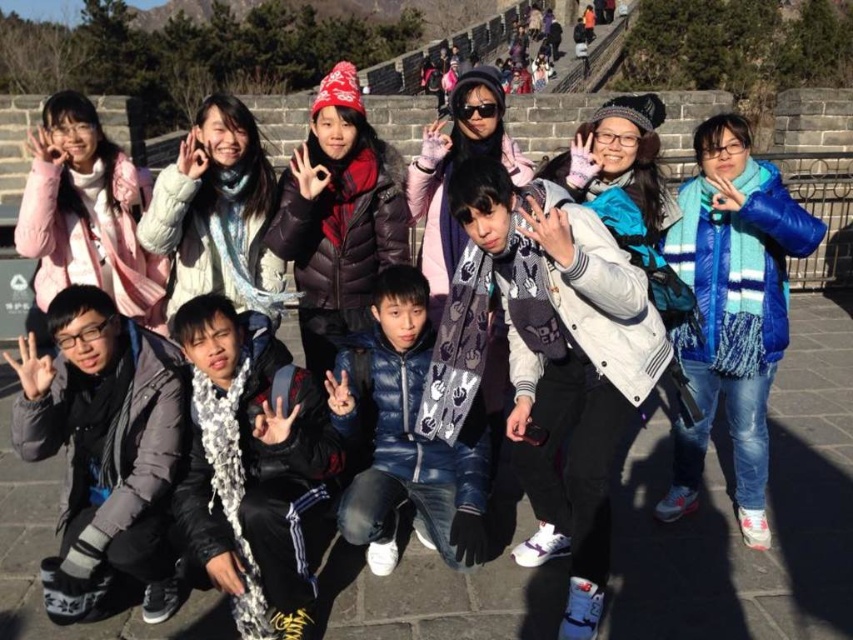
You are a photographer standing at the base of the Great Wall, and you want to take a photo of the gray woolen sweater at lower left and the blue down jacket at center. The camera you have can focus on subjects within a 3 meter range. Will both subjects be in focus?

The distance between the gray woolen sweater at lower left and the blue down jacket at center is 2.83 meters, which is within the camera focus range of 3 meters. Therefore, both subjects will be in focus.

You are a photographer trying to capture a group photo of the ten people wearing winter clothing on the Great Wall. You notice the white fleece jacket at center and the gray woolen sweater at lower left. Which clothing item takes up more horizontal space in the photo?

The white fleece jacket at center takes up more horizontal space in the photo because its width surpasses that of the gray woolen sweater at lower left.